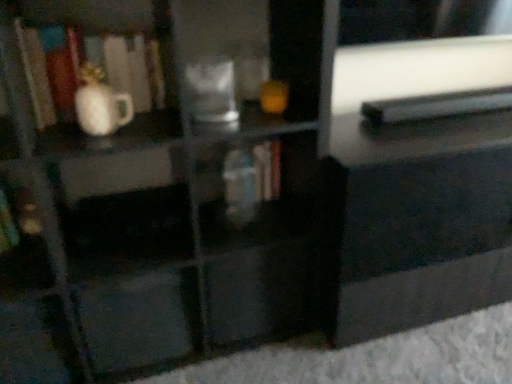
The width and height of the screenshot is (512, 384). What are the coordinates of `white glossy mug at upper left, acting as the third book starting from the right` in the screenshot? It's located at (114, 82).

Image resolution: width=512 pixels, height=384 pixels. What do you see at coordinates (100, 104) in the screenshot? I see `white glossy vase at left` at bounding box center [100, 104].

Where is `black glossy drawer at center, the 2th drawer viewed from the left`? This screenshot has height=384, width=512. black glossy drawer at center, the 2th drawer viewed from the left is located at coordinates (x=258, y=293).

What do you see at coordinates (139, 318) in the screenshot? Image resolution: width=512 pixels, height=384 pixels. I see `matte black drawer at center, which is counted as the 2th drawer, starting from the right` at bounding box center [139, 318].

Identify the location of hardcover book at center, which is the 2th book from right to left. (253, 174).

Which object is positioned more to the left, hardcover book at center, the second book viewed from the left, or black glossy drawer at center, the 2th drawer viewed from the left?

From the viewer's perspective, hardcover book at center, the second book viewed from the left, appears more on the left side.

Considering the relative sizes of hardcover book at center, the second book viewed from the left, and black glossy drawer at center, the 2th drawer viewed from the left, in the image provided, is hardcover book at center, the second book viewed from the left, taller than black glossy drawer at center, the 2th drawer viewed from the left,?

Incorrect, the height of hardcover book at center, the second book viewed from the left, is not larger of that of black glossy drawer at center, the 2th drawer viewed from the left.

Can you tell me how much hardcover book at center, the second book viewed from the left, and black glossy drawer at center, the 2th drawer viewed from the left, differ in facing direction?

2.1 degrees.

In the scene shown: Considering the sizes of white glossy mug at upper left, marked as the 1th book in a left-to-right arrangement, and white glossy vase at left in the image, is white glossy mug at upper left, marked as the 1th book in a left-to-right arrangement, bigger or smaller than white glossy vase at left?

Considering their sizes, white glossy mug at upper left, marked as the 1th book in a left-to-right arrangement, takes up more space than white glossy vase at left.

How different are the orientations of white glossy mug at upper left, acting as the third book starting from the right, and white glossy vase at left in degrees?

The angle between the facing direction of white glossy mug at upper left, acting as the third book starting from the right, and the facing direction of white glossy vase at left is 0.00072 degrees.

Is white glossy mug at upper left, acting as the third book starting from the right, turned away from white glossy vase at left?

No, white glossy mug at upper left, acting as the third book starting from the right,'s orientation is not away from white glossy vase at left.

Does point (241, 182) come farther from viewer compared to point (109, 109)?

Yes.

Who is smaller, hardcover book at center, the second book viewed from the left, or white glossy vase at left?

Smaller between the two is white glossy vase at left.

Is hardcover book at center, the second book viewed from the left, not within white glossy vase at left?

Absolutely, hardcover book at center, the second book viewed from the left, is external to white glossy vase at left.

From a real-world perspective, which book is the 2nd one underneath the white glossy vase at left? Please provide its 2D coordinates.

[(253, 174)]

Could you tell me if white glossy vase at left is turned towards black plastic book at upper right, positioned as the 1th book in right-to-left order?

No, white glossy vase at left is not turned towards black plastic book at upper right, positioned as the 1th book in right-to-left order.

From a real-world perspective, is white glossy vase at left positioned above or below black plastic book at upper right, the 3th book viewed from the left?

white glossy vase at left is situated higher than black plastic book at upper right, the 3th book viewed from the left, in the real world.

Considering the positions of points (129, 105) and (503, 100), is point (129, 105) closer to camera compared to point (503, 100)?

Yes, it is.

From the image's perspective, would you say white glossy vase at left is shown under black plastic book at upper right, positioned as the 1th book in right-to-left order?

Correct, white glossy vase at left appears lower than black plastic book at upper right, positioned as the 1th book in right-to-left order, in the image.

Based on the photo, does hardcover book at center, the second book viewed from the left, have a greater width compared to black plastic book at upper right, the 3th book viewed from the left?

Indeed, hardcover book at center, the second book viewed from the left, has a greater width compared to black plastic book at upper right, the 3th book viewed from the left.

Can you see hardcover book at center, the second book viewed from the left, touching black plastic book at upper right, the 3th book viewed from the left?

No, hardcover book at center, the second book viewed from the left, is not beside black plastic book at upper right, the 3th book viewed from the left.

Would you say black plastic book at upper right, the 3th book viewed from the left, is part of hardcover book at center, which is the 2th book from right to left,'s contents?

Definitely not — black plastic book at upper right, the 3th book viewed from the left, is not inside hardcover book at center, which is the 2th book from right to left.

Is black plastic book at upper right, positioned as the 1th book in right-to-left order, far away from black glossy drawer at center, the 2th drawer viewed from the left?

No.

Is black plastic book at upper right, the 3th book viewed from the left, oriented away from black glossy drawer at center, the 2th drawer viewed from the left?

black plastic book at upper right, the 3th book viewed from the left, is not turned away from black glossy drawer at center, the 2th drawer viewed from the left.

In the scene shown: Do you think black plastic book at upper right, positioned as the 1th book in right-to-left order, is within black glossy drawer at center, which is the 1th drawer from right to left, or outside of it?

black plastic book at upper right, positioned as the 1th book in right-to-left order, is not inside black glossy drawer at center, which is the 1th drawer from right to left, it's outside.

Is black plastic book at upper right, the 3th book viewed from the left, to the left or to the right of black glossy drawer at center, which is the 1th drawer from right to left, in the image?

black plastic book at upper right, the 3th book viewed from the left, is positioned on black glossy drawer at center, which is the 1th drawer from right to left,'s right side.

Could you tell me if black plastic book at upper right, positioned as the 1th book in right-to-left order, is turned towards white glossy mug at upper left, acting as the third book starting from the right?

No, black plastic book at upper right, positioned as the 1th book in right-to-left order, does not turn towards white glossy mug at upper left, acting as the third book starting from the right.

Is black plastic book at upper right, positioned as the 1th book in right-to-left order, closer to camera compared to white glossy mug at upper left, acting as the third book starting from the right?

No, it is not.

Measure the distance between black plastic book at upper right, the 3th book viewed from the left, and white glossy mug at upper left, acting as the third book starting from the right.

33.38 inches.

From the image's perspective, which is below, black plastic book at upper right, the 3th book viewed from the left, or white glossy mug at upper left, marked as the 1th book in a left-to-right arrangement?

white glossy mug at upper left, marked as the 1th book in a left-to-right arrangement, appears lower in the image.

From a real-world perspective, count 2nd drawers downward from the hardcover book at center, which is the 2th book from right to left, and point to it. Please provide its 2D coordinates.

[(258, 293)]

From the image's perspective, which book is the 1st one above the white glossy vase at left? Please provide its 2D coordinates.

[(114, 82)]

Considering their positions, is black plastic book at upper right, positioned as the 1th book in right-to-left order, positioned closer to white glossy mug at upper left, acting as the third book starting from the right, than hardcover book at center, the second book viewed from the left?

The object closer to white glossy mug at upper left, acting as the third book starting from the right, is hardcover book at center, the second book viewed from the left.

Looking at the image, which one is located closer to white glossy mug at upper left, marked as the 1th book in a left-to-right arrangement, hardcover book at center, the second book viewed from the left, or black glossy drawer at center, the 2th drawer viewed from the left?

hardcover book at center, the second book viewed from the left, is closer to white glossy mug at upper left, marked as the 1th book in a left-to-right arrangement.

Which object lies further to the anchor point black glossy drawer at center, which is the 1th drawer from right to left, matte black drawer at center, the first drawer positioned from the left, or hardcover book at center, which is the 2th book from right to left?

hardcover book at center, which is the 2th book from right to left, is further to black glossy drawer at center, which is the 1th drawer from right to left.

When comparing their distances from black plastic book at upper right, the 3th book viewed from the left, does white glossy vase at left or matte black drawer at center, the first drawer positioned from the left, seem further?

matte black drawer at center, the first drawer positioned from the left, lies further to black plastic book at upper right, the 3th book viewed from the left, than the other object.

From the image, which object appears to be farther from hardcover book at center, the second book viewed from the left, black plastic book at upper right, positioned as the 1th book in right-to-left order, or white glossy mug at upper left, marked as the 1th book in a left-to-right arrangement?

The object further to hardcover book at center, the second book viewed from the left, is black plastic book at upper right, positioned as the 1th book in right-to-left order.

Which object lies nearer to the anchor point hardcover book at center, the second book viewed from the left, black plastic book at upper right, the 3th book viewed from the left, or black glossy drawer at center, the 2th drawer viewed from the left?

Based on the image, black glossy drawer at center, the 2th drawer viewed from the left, appears to be nearer to hardcover book at center, the second book viewed from the left.

Based on their spatial positions, is white glossy vase at left or black glossy drawer at center, which is the 1th drawer from right to left, closer to white glossy mug at upper left, marked as the 1th book in a left-to-right arrangement?

white glossy vase at left is positioned closer to the anchor white glossy mug at upper left, marked as the 1th book in a left-to-right arrangement.

Based on their spatial positions, is matte black drawer at center, the first drawer positioned from the left, or hardcover book at center, the second book viewed from the left, closer to white glossy vase at left?

hardcover book at center, the second book viewed from the left, lies closer to white glossy vase at left than the other object.

Identify the location of drawer between hardcover book at center, which is the 2th book from right to left, and matte black drawer at center, the first drawer positioned from the left, vertically. This screenshot has width=512, height=384. coord(258,293).

Identify the location of book between white glossy mug at upper left, acting as the third book starting from the right, and matte black drawer at center, which is counted as the 2th drawer, starting from the right, in the vertical direction. This screenshot has width=512, height=384. (x=253, y=174).

You are a GUI agent. You are given a task and a screenshot of the screen. Output one action in this format:
    pyautogui.click(x=<x>, y=<y>)
    Task: Click on the vase between white glossy mug at upper left, marked as the 1th book in a left-to-right arrangement, and hardcover book at center, which is the 2th book from right to left, from left to right
    Image resolution: width=512 pixels, height=384 pixels.
    Given the screenshot: What is the action you would take?
    pyautogui.click(x=100, y=104)

At what (x,y) coordinates should I click in order to perform the action: click on drawer between white glossy mug at upper left, marked as the 1th book in a left-to-right arrangement, and matte black drawer at center, which is counted as the 2th drawer, starting from the right, vertically. Please return your answer as a coordinate pair (x, y). Image resolution: width=512 pixels, height=384 pixels. Looking at the image, I should click on (258, 293).